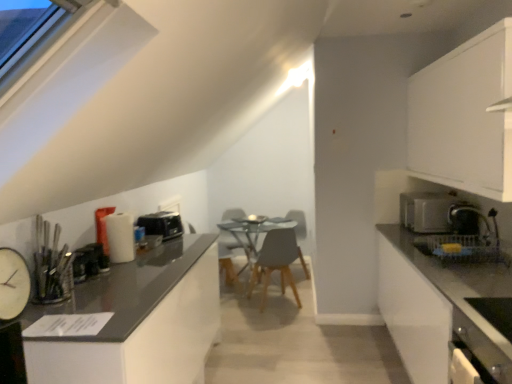
Question: Does white clock at left, the 4th appliance in the back-to-front sequence, appear on the left side of black plastic toaster at left, which ranks as the 1th appliance in back-to-front order?

Choices:
 (A) yes
 (B) no

Answer: (A)

Question: Can you confirm if white clock at left, which ranks as the 4th appliance in right-to-left order, is shorter than black plastic toaster at left, acting as the fourth appliance starting from the front?

Choices:
 (A) yes
 (B) no

Answer: (B)

Question: Are white clock at left, the 1th appliance from the left, and black plastic toaster at left, acting as the fourth appliance starting from the front, far apart?

Choices:
 (A) no
 (B) yes

Answer: (B)

Question: Is the surface of white clock at left, which ranks as the 4th appliance in right-to-left order, in direct contact with black plastic toaster at left, the 2th appliance when ordered from right to left?

Choices:
 (A) no
 (B) yes

Answer: (A)

Question: Does white clock at left, the 1th appliance from the left, have a lesser width compared to black plastic toaster at left, acting as the fourth appliance starting from the front?

Choices:
 (A) yes
 (B) no

Answer: (A)

Question: Is satin black toaster at right, which ranks as the second appliance in back-to-front order, inside the boundaries of metallic black toaster at left, acting as the 2th appliance starting from the front, or outside?

Choices:
 (A) inside
 (B) outside

Answer: (B)

Question: Relative to metallic black toaster at left, which is the third appliance from back to front, is satin black toaster at right, placed as the 1th appliance when sorted from right to left, in front or behind?

Choices:
 (A) behind
 (B) front

Answer: (A)

Question: From their relative heights in the image, would you say satin black toaster at right, placed as the 1th appliance when sorted from right to left, is taller or shorter than metallic black toaster at left, which is the 3th appliance from right to left?

Choices:
 (A) short
 (B) tall

Answer: (B)

Question: Would you say satin black toaster at right, the 3th appliance viewed from the front, is to the left or to the right of metallic black toaster at left, acting as the 2th appliance starting from the front, in the picture?

Choices:
 (A) left
 (B) right

Answer: (B)

Question: From their relative heights in the image, would you say white matte cabinet at upper right, arranged as the first cabinetry when viewed from the top, is taller or shorter than light gray matte chair at center?

Choices:
 (A) short
 (B) tall

Answer: (B)

Question: Considering the relative positions of white matte cabinet at upper right, the 2th cabinetry in the bottom-to-top sequence, and light gray matte chair at center in the image provided, is white matte cabinet at upper right, the 2th cabinetry in the bottom-to-top sequence, to the left or to the right of light gray matte chair at center?

Choices:
 (A) left
 (B) right

Answer: (B)

Question: In terms of width, does white matte cabinet at upper right, which is counted as the 1th cabinetry, starting from the right, look wider or thinner when compared to light gray matte chair at center?

Choices:
 (A) thin
 (B) wide

Answer: (A)

Question: From a real-world perspective, is white matte cabinet at upper right, arranged as the first cabinetry when viewed from the top, positioned above or below light gray matte chair at center?

Choices:
 (A) above
 (B) below

Answer: (A)

Question: Considering the positions of satin silver toaster at right and white clock at left, which ranks as the 4th appliance in right-to-left order, in the image, is satin silver toaster at right bigger or smaller than white clock at left, which ranks as the 4th appliance in right-to-left order,?

Choices:
 (A) big
 (B) small

Answer: (A)

Question: From the image's perspective, is satin silver toaster at right above or below white clock at left, which ranks as the 4th appliance in right-to-left order?

Choices:
 (A) above
 (B) below

Answer: (A)